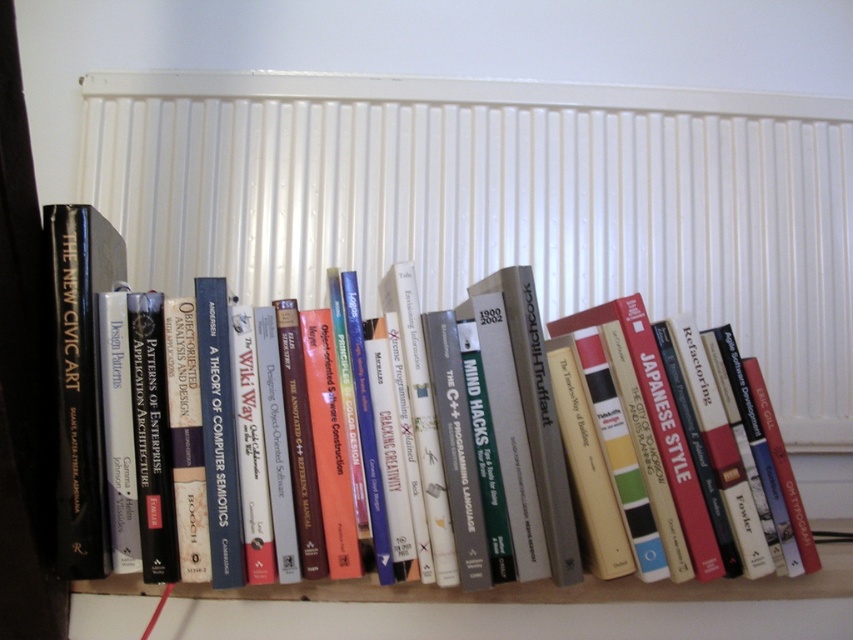
Question: Which point is farther to the camera?

Choices:
 (A) coord(57,273)
 (B) coord(553,266)

Answer: (B)

Question: Which of the following is the farthest from the observer?

Choices:
 (A) (666, 285)
 (B) (605, 547)
 (C) (42, 214)

Answer: (A)

Question: Which object is positioned farthest from the hardcover book at center?

Choices:
 (A) white textured radiator at upper center
 (B) black hardcover book at left

Answer: (A)

Question: Is white textured radiator at upper center closer to camera compared to hardcover book at center?

Choices:
 (A) yes
 (B) no

Answer: (B)

Question: Is white textured radiator at upper center bigger than hardcover book at center?

Choices:
 (A) yes
 (B) no

Answer: (A)

Question: Is white textured radiator at upper center further to camera compared to hardcover book at center?

Choices:
 (A) yes
 (B) no

Answer: (A)